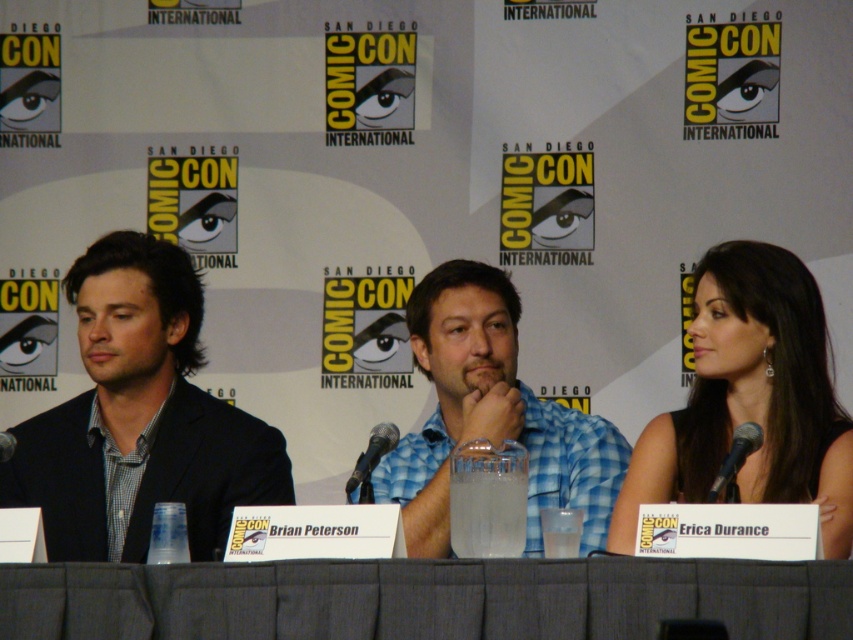
Between blue checkered shirt at center and black metallic microphone at center, which one is positioned lower?

Positioned lower is blue checkered shirt at center.

Image resolution: width=853 pixels, height=640 pixels. Describe the element at coordinates (491, 417) in the screenshot. I see `blue checkered shirt at center` at that location.

Locate an element on the screen. The width and height of the screenshot is (853, 640). blue checkered shirt at center is located at coordinates (491, 417).

Who is taller, matte black suit at left or black silk dress at right?

With more height is matte black suit at left.

The width and height of the screenshot is (853, 640). I want to click on matte black suit at left, so click(x=138, y=419).

Between gray fabric table at center and matte black suit at left, which one has less height?

gray fabric table at center

Find the location of a particular element. The image size is (853, 640). gray fabric table at center is located at coordinates (424, 598).

Image resolution: width=853 pixels, height=640 pixels. What are the coordinates of `gray fabric table at center` in the screenshot? It's located at (424, 598).